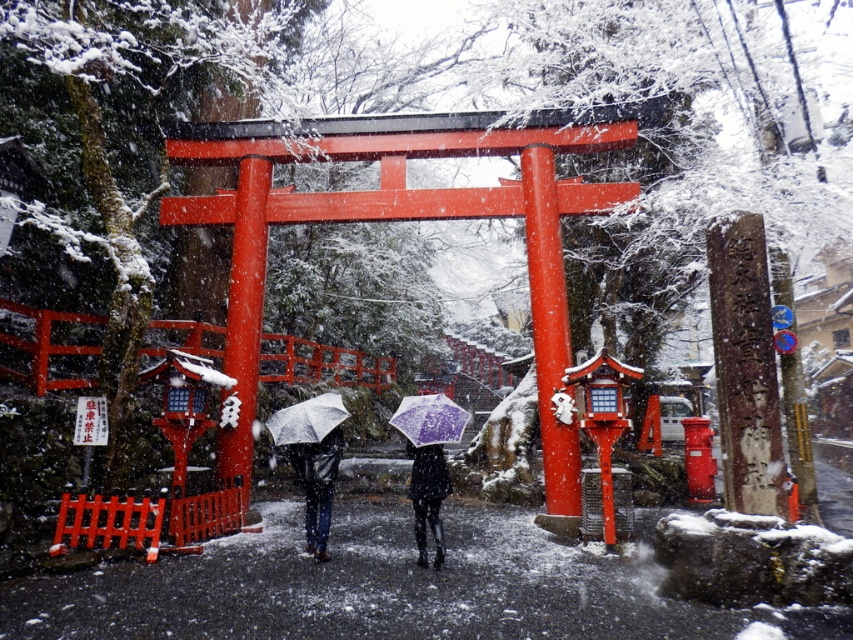
You are standing at the entrance of a traditional Japanese shrine and notice a person wearing a matte black jacket at center holding a purple matte umbrella at center. Which object is taller?

The matte black jacket at center has a greater height compared to the purple matte umbrella at center, so the matte black jacket at center is taller.

You are a photographer planning to capture a symmetrical shot of the torii gate. You notice a matte black jacket at center and a purple matte umbrella at center in the frame. Which object should you move to maintain symmetry?

To maintain symmetry, you should move the purple matte umbrella at center because the matte black jacket at center is wider, making it more central and less disruptive to the symmetry.